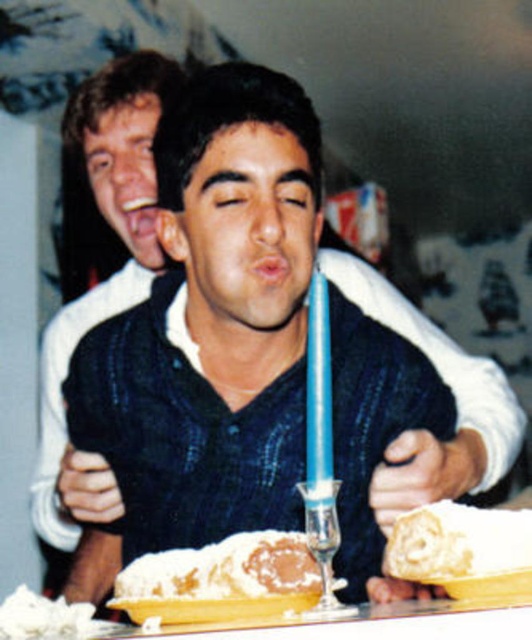
Is white powdered cake at center to the left of white fluffy cake at lower center from the viewer's perspective?

Indeed, white powdered cake at center is positioned on the left side of white fluffy cake at lower center.

Is white powdered cake at center to the right of white fluffy cake at lower center from the viewer's perspective?

No, white powdered cake at center is not to the right of white fluffy cake at lower center.

This screenshot has height=640, width=532. I want to click on white powdered cake at center, so click(x=221, y=580).

Can you confirm if blue wax candle at center is positioned above white fluffy whipped cream at lower left?

Yes.

The width and height of the screenshot is (532, 640). Find the location of `blue wax candle at center`. blue wax candle at center is located at coordinates (319, 387).

This screenshot has width=532, height=640. I want to click on blue wax candle at center, so click(319, 387).

Where is `blue wax candle at center`? blue wax candle at center is located at coordinates (319, 387).

Does point (419, 518) come behind point (87, 605)?

No, (419, 518) is closer to viewer.

Between point (389, 556) and point (34, 602), which one is positioned in front?

Point (389, 556)

Where is `white fluffy cake at lower center`? The width and height of the screenshot is (532, 640). white fluffy cake at lower center is located at coordinates (461, 548).